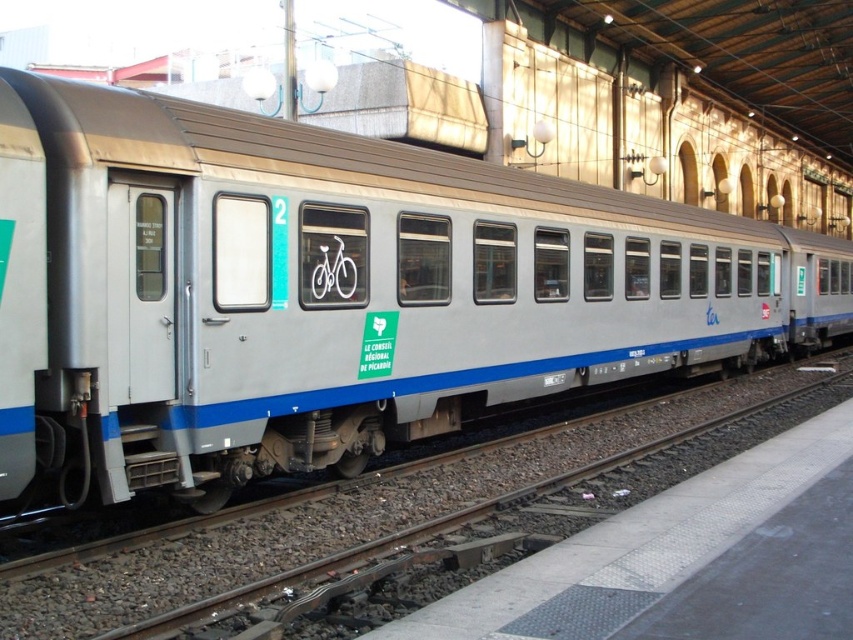
Question: Among these points, which one is farthest from the camera?

Choices:
 (A) (467, 486)
 (B) (543, 316)

Answer: (B)

Question: Does metallic silver train at center appear over metal track at lower left?

Choices:
 (A) no
 (B) yes

Answer: (B)

Question: Can you confirm if metallic silver train at center is wider than metal track at lower left?

Choices:
 (A) no
 (B) yes

Answer: (B)

Question: Is metallic silver train at center to the left of metal track at lower left from the viewer's perspective?

Choices:
 (A) yes
 (B) no

Answer: (B)